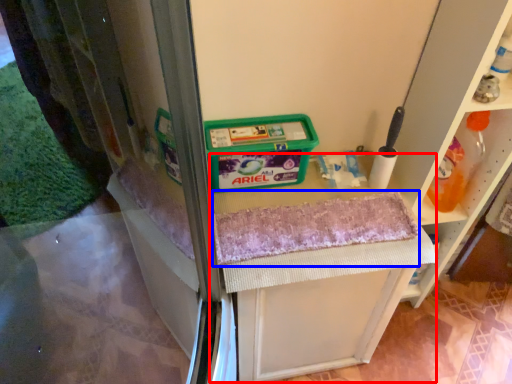
Question: Which object is further to the camera taking this photo, vanity (highlighted by a red box) or bath towel (highlighted by a blue box)?

Choices:
 (A) vanity
 (B) bath towel

Answer: (A)